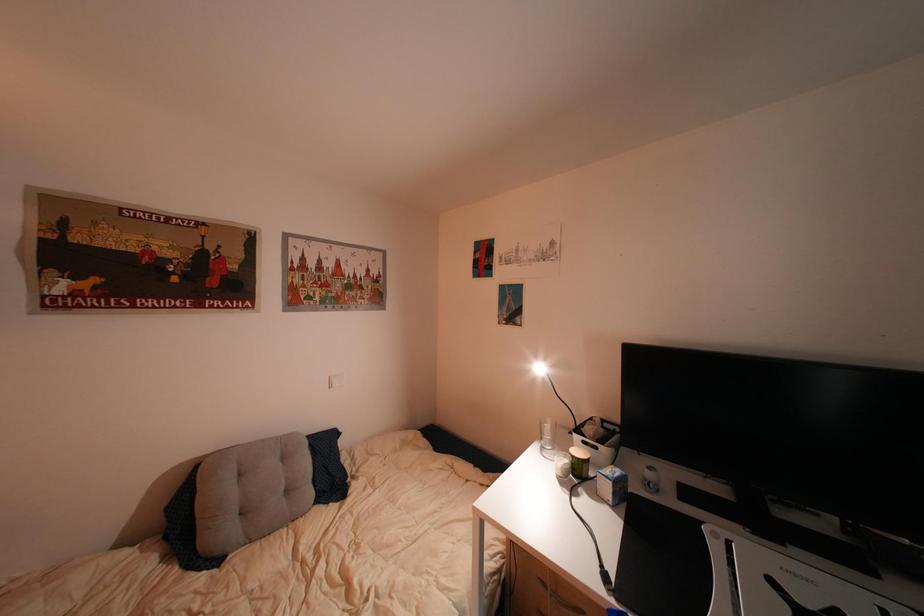
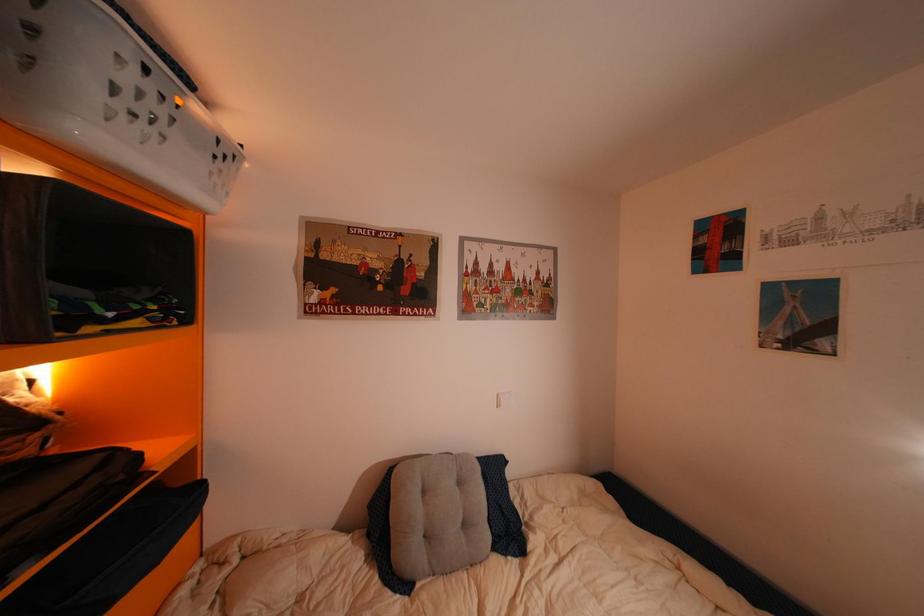
In the scene shown: The images are taken continuously from a first-person perspective. In which direction are you moving?

The movement direction of the cameraman is left, forward.